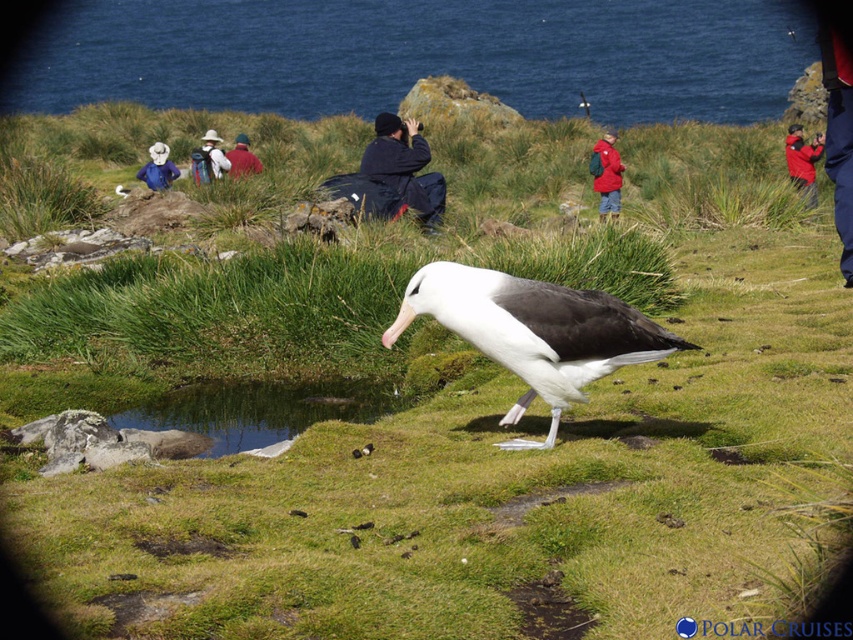
Question: Among these objects, which one is farthest from the camera?

Choices:
 (A) white matte mollymawk at center
 (B) blue water at upper center
 (C) white fabric hat at upper center

Answer: (B)

Question: Considering the real-world distances, which object is farthest from the red fabric jacket at center?

Choices:
 (A) white fabric hat at upper center
 (B) red fleece jacket at upper right

Answer: (A)

Question: Is red fabric jacket at center smaller than red jacket at center?

Choices:
 (A) no
 (B) yes

Answer: (A)

Question: Is white matte mollymawk at center thinner than red fleece jacket at upper right?

Choices:
 (A) yes
 (B) no

Answer: (B)

Question: Estimate the real-world distances between objects in this image. Which object is farther from the red fabric jacket at center?

Choices:
 (A) red fleece jacket at upper right
 (B) red jacket at center
 (C) dark blue jacket at center

Answer: (B)

Question: Does red fleece jacket at upper right lie in front of red fabric jacket at center?

Choices:
 (A) no
 (B) yes

Answer: (A)